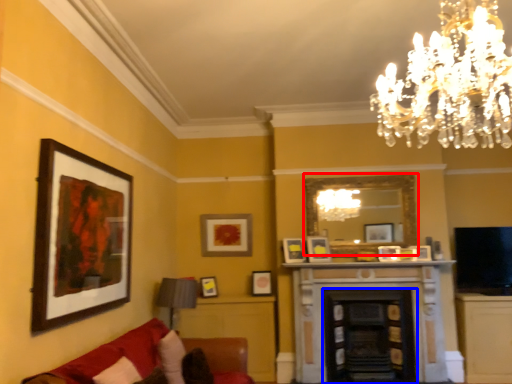
Question: Which object appears farthest to the camera in this image, mirror (highlighted by a red box) or fireplace (highlighted by a blue box)?

Choices:
 (A) mirror
 (B) fireplace

Answer: (A)